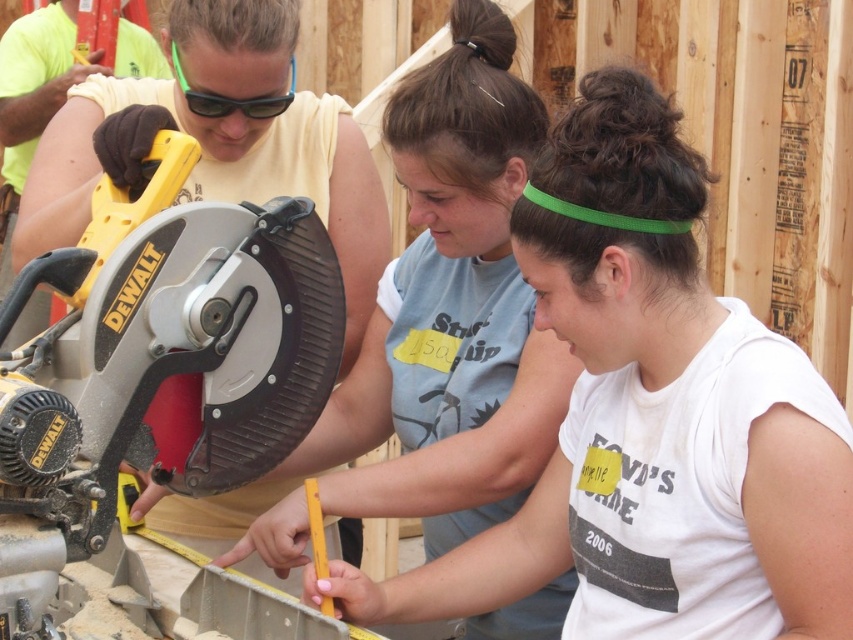
Question: In this image, where is yellow plastic circular saw at left located relative to matte yellow shirt at center?

Choices:
 (A) below
 (B) above

Answer: (A)

Question: Does white matte shirt at center have a greater width compared to yellow plastic circular saw at left?

Choices:
 (A) yes
 (B) no

Answer: (A)

Question: Which point is farther to the camera?

Choices:
 (A) white matte shirt at center
 (B) yellow plastic circular saw at left
 (C) green plastic goggles at upper center

Answer: (C)

Question: Among these objects, which one is nearest to the camera?

Choices:
 (A) matte yellow shirt at center
 (B) yellow plastic circular saw at left
 (C) green plastic goggles at upper center
 (D) white matte shirt at center

Answer: (B)

Question: Is yellow plastic circular saw at left bigger than matte yellow shirt at center?

Choices:
 (A) yes
 (B) no

Answer: (B)

Question: Among these points, which one is farthest from the camera?

Choices:
 (A) (183, 291)
 (B) (291, 88)
 (C) (515, 400)

Answer: (B)